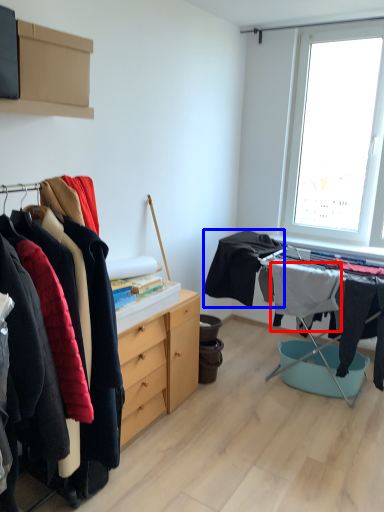
Question: Which point is further to the camera, clothing (highlighted by a red box) or clothing (highlighted by a blue box)?

Choices:
 (A) clothing
 (B) clothing

Answer: (A)